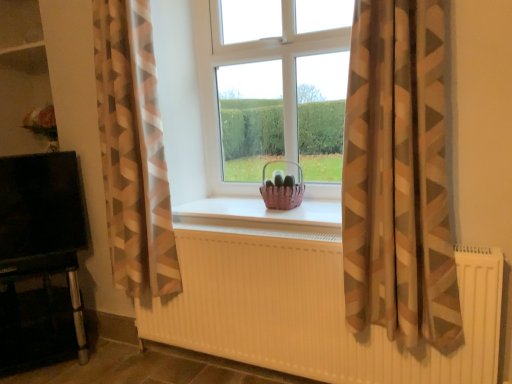
Identify the location of free space above pink woven basket at center (from a real-world perspective). The image size is (512, 384). (257, 202).